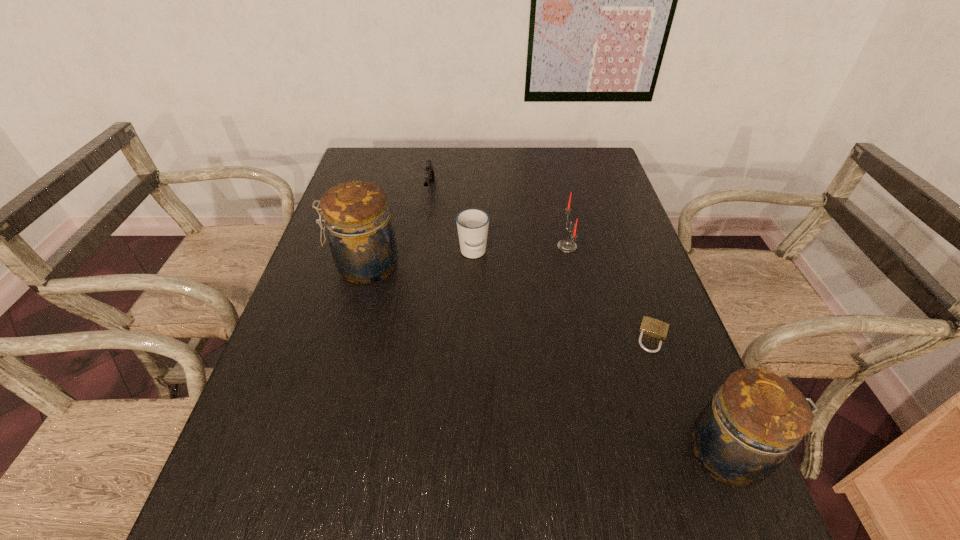
The image size is (960, 540). I want to click on the tallest object, so click(x=361, y=238).

I want to click on the taller jar, so click(361, 238).

This screenshot has width=960, height=540. I want to click on the second tallest object, so click(741, 437).

This screenshot has width=960, height=540. Find the location of `the nearer jar`. the nearer jar is located at coordinates (741, 437).

Find the location of a particular element. the fourth object from right to left is located at coordinates (472, 224).

Find the location of a particular element. the fourth tallest object is located at coordinates (472, 224).

Locate an element on the screen. The image size is (960, 540). the fifth tallest object is located at coordinates (429, 171).

The image size is (960, 540). Identify the location of the second object from left to right. (429, 171).

The width and height of the screenshot is (960, 540). In order to click on the fourth shortest object in this screenshot , I will do [566, 245].

The width and height of the screenshot is (960, 540). In order to click on the third object from right to left in this screenshot , I will do `click(566, 245)`.